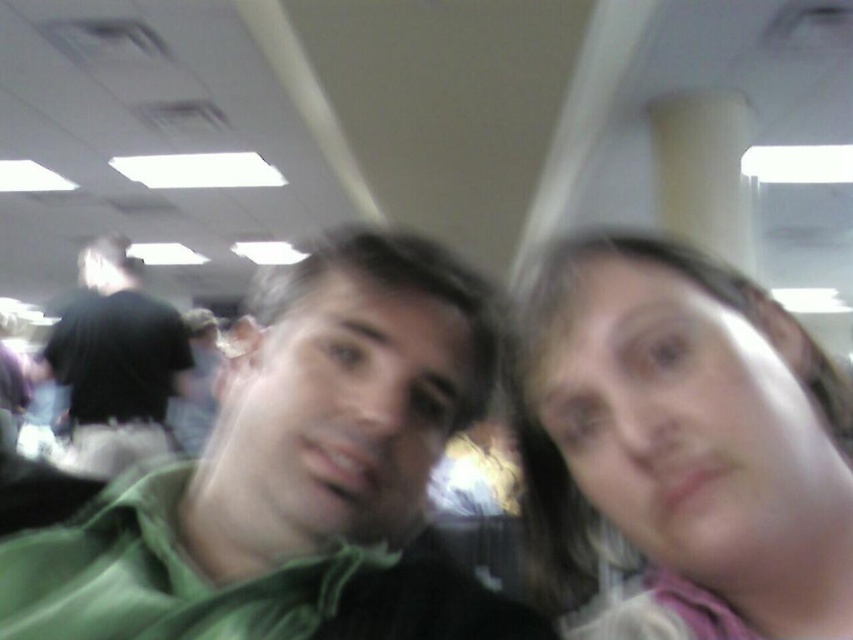
Question: Which of the following is the farthest from the observer?

Choices:
 (A) (85, 358)
 (B) (366, 573)
 (C) (688, 595)

Answer: (A)

Question: Which point is closer to the camera taking this photo?

Choices:
 (A) (583, 321)
 (B) (354, 317)
 (C) (165, 324)

Answer: (A)

Question: In this image, where is green matte shirt at center located relative to black matte shirt at left?

Choices:
 (A) below
 (B) above

Answer: (A)

Question: Can you confirm if blonde hair at upper right is smaller than black matte shirt at left?

Choices:
 (A) yes
 (B) no

Answer: (A)

Question: Estimate the real-world distances between objects in this image. Which object is closer to the green matte shirt at center?

Choices:
 (A) black matte shirt at left
 (B) blonde hair at upper right

Answer: (B)

Question: Does green matte shirt at center lie behind blonde hair at upper right?

Choices:
 (A) no
 (B) yes

Answer: (B)